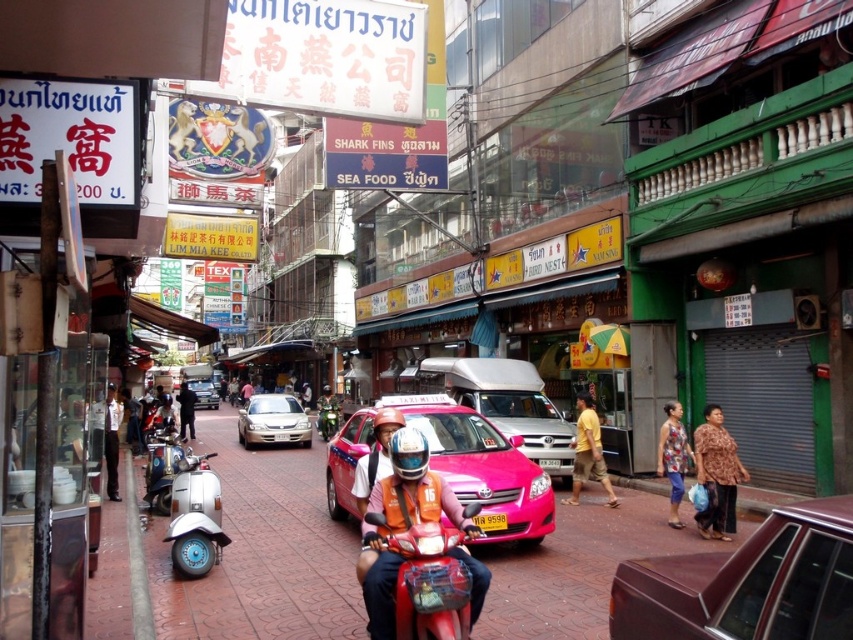
Is white glossy scooter at left bigger than metallic silver motorcycle at center?

Yes, white glossy scooter at left is bigger than metallic silver motorcycle at center.

Where is `white glossy scooter at left`? white glossy scooter at left is located at coordinates (161, 467).

Image resolution: width=853 pixels, height=640 pixels. What are the coordinates of `white glossy scooter at left` in the screenshot? It's located at (161, 467).

Is maroon matte car at lower right positioned behind silver metallic scooter at center-left?

No, it is not.

Identify the location of maroon matte car at lower right. This screenshot has height=640, width=853. (746, 582).

Does point (668, 557) come closer to viewer compared to point (202, 515)?

Yes, point (668, 557) is closer to viewer.

Identify the location of maroon matte car at lower right. This screenshot has height=640, width=853. (746, 582).

Can you confirm if silver metallic scooter at center-left is shorter than metallic silver sedan at center?

Indeed, silver metallic scooter at center-left has a lesser height compared to metallic silver sedan at center.

Which of these two, silver metallic scooter at center-left or metallic silver sedan at center, stands shorter?

With less height is silver metallic scooter at center-left.

I want to click on silver metallic scooter at center-left, so click(x=195, y=516).